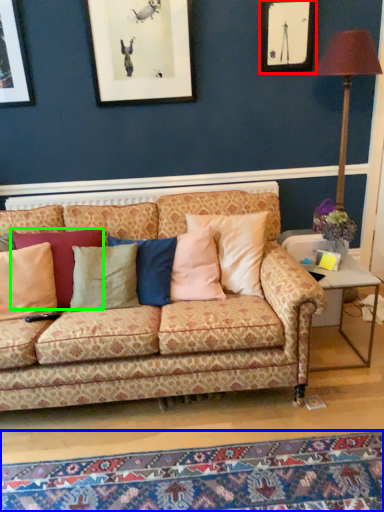
Question: Which object is the farthest from picture frame (highlighted by a red box)? Choose among these: mat (highlighted by a blue box) or pillow (highlighted by a green box).

Choices:
 (A) mat
 (B) pillow

Answer: (A)